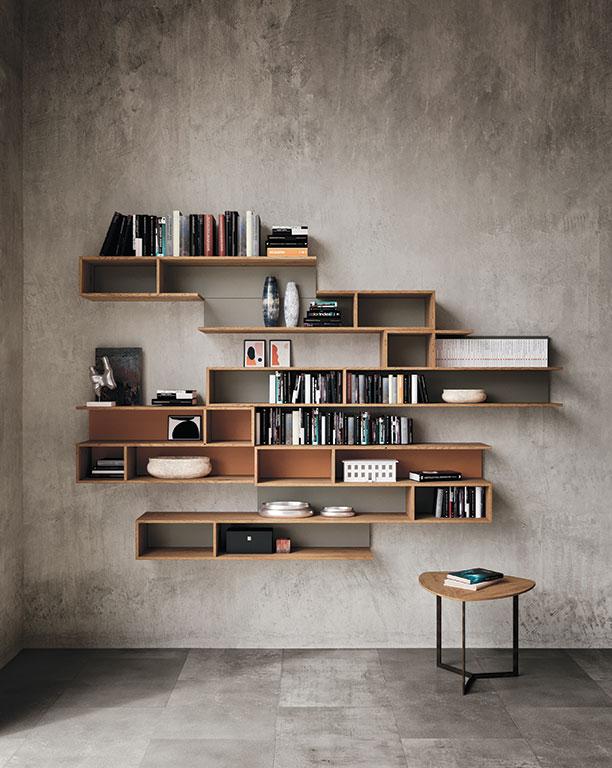
Where is `bowls`? bowls is located at coordinates (338, 508), (295, 508), (455, 396), (193, 465).